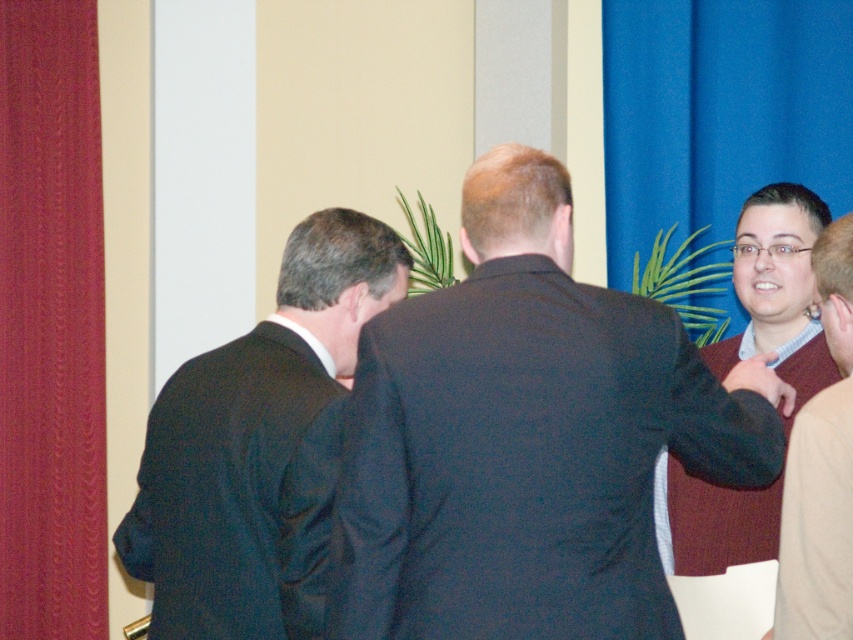
Question: Can you confirm if dark suit jacket at center is wider than matte black suit at center?

Choices:
 (A) yes
 (B) no

Answer: (A)

Question: Which object is positioned farthest from the dark blue fabric business suit at right?

Choices:
 (A) maroon sweater at right
 (B) velvet-like red curtain at left
 (C) dark suit jacket at center

Answer: (B)

Question: Is dark suit jacket at center positioned at the back of matte black suit at center?

Choices:
 (A) yes
 (B) no

Answer: (B)

Question: Which object appears closest to the camera in this image?

Choices:
 (A) maroon sweater at right
 (B) dark blue fabric business suit at right
 (C) dark suit jacket at center
 (D) matte black suit at center

Answer: (C)

Question: Which point is closer to the camera taking this photo?

Choices:
 (A) (x=192, y=412)
 (B) (x=801, y=444)
 (C) (x=51, y=112)

Answer: (B)

Question: Does dark suit jacket at center have a larger size compared to dark blue fabric business suit at right?

Choices:
 (A) no
 (B) yes

Answer: (B)